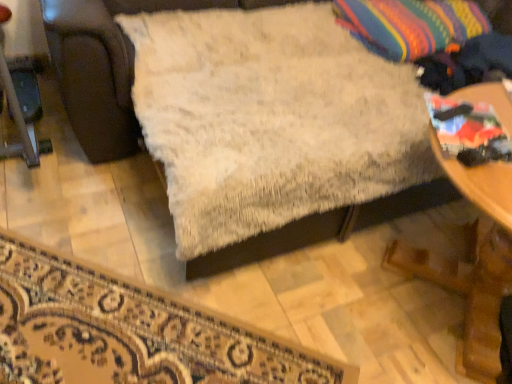
Question: Considering the positions of white fluffy blanket at center and white fluffy rug at lower center in the image, is white fluffy blanket at center wider or thinner than white fluffy rug at lower center?

Choices:
 (A) thin
 (B) wide

Answer: (B)

Question: Considering the positions of white fluffy blanket at center and white fluffy rug at lower center in the image, is white fluffy blanket at center bigger or smaller than white fluffy rug at lower center?

Choices:
 (A) small
 (B) big

Answer: (B)

Question: Estimate the real-world distances between objects in this image. Which object is closer to the wooden table at lower right?

Choices:
 (A) white fluffy blanket at center
 (B) multicolored woven throw pillow at upper right
 (C) white fluffy rug at lower center

Answer: (A)

Question: Which is farther from the white fluffy rug at lower center?

Choices:
 (A) white fluffy blanket at center
 (B) wooden table at lower right
 (C) multicolored woven throw pillow at upper right

Answer: (C)